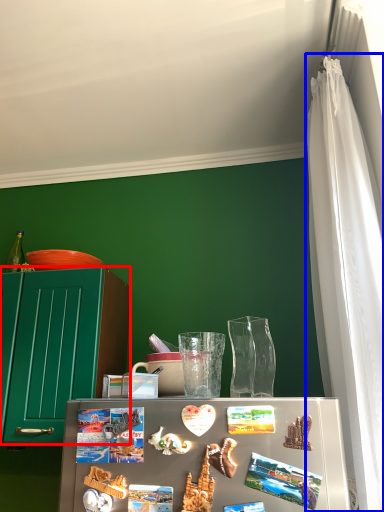
Question: Which point is further to the camera, cabinetry (highlighted by a red box) or curtain (highlighted by a blue box)?

Choices:
 (A) cabinetry
 (B) curtain

Answer: (A)